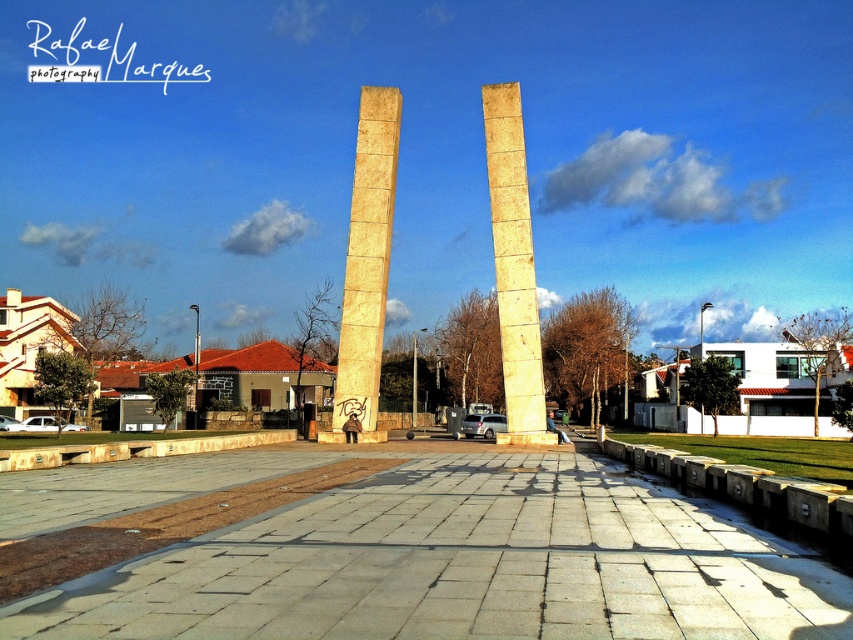
You are standing at the center of the public square and see the point marked at coordinates point (366, 262). Based on the scene description, can you determine which object this point is located on?

The point (366, 262) is on the yellow stone column at center.

You are a city planner assessing the central square. You notice two central structures labeled as yellow stone column at center and yellow marble pillar at center. Which of these two has a greater width?

The yellow stone column at center has a greater width than the yellow marble pillar at center according to the description.

You are standing in the public square and want to take a closer look at the yellow stone column at center. If you walk straight ahead, will you get closer to the column?

Yes, walking straight ahead will bring you closer to the yellow stone column at center since it is positioned directly in front of you at a distance of 33.73 meters.